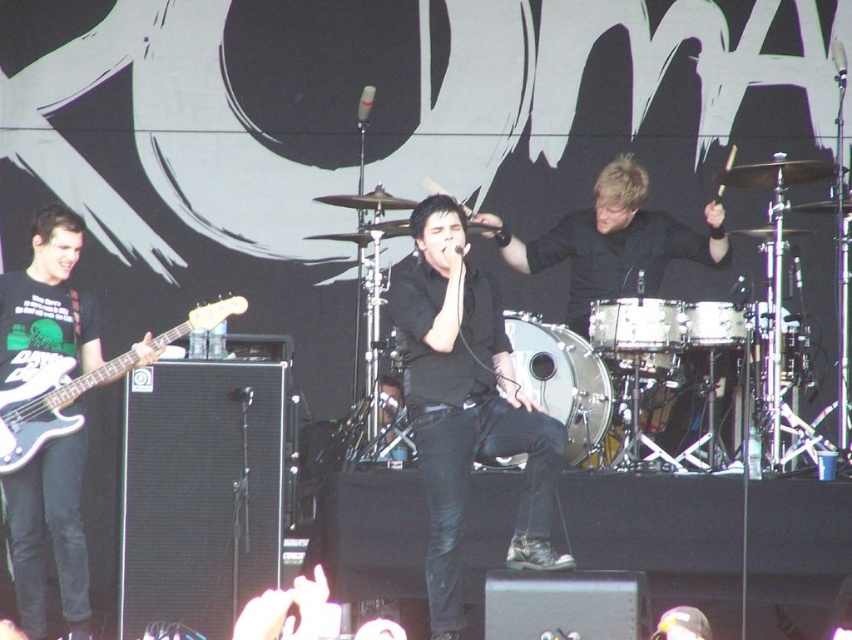
You are a stagehand who needs to adjust the microphone stand between the black matte shirt at center and the matte black guitar at left. The stand requires 3 feet of space to fit. Can you place it there?

The black matte shirt at center is 4.31 feet from the matte black guitar at left, so yes, the microphone stand requiring 3 feet of space can be placed between them since there is enough space.

You are a stagehand setting up the band equipment. You need to retrieve the matte black guitar at left and the white matte electric guitar at left. Based on their positions, which guitar is closer to the floor?

The matte black guitar at left is positioned under the white matte electric guitar at left, so the matte black guitar at left is closer to the floor.

You are a photographer at the concert. You want to capture a photo where the black matte shirt at center and the white matte electric guitar at left are both visible. Based on their positions, which object should be placed on the right side of the photo frame?

The black matte shirt at center should be placed on the right side of the photo frame since it is to the right of the white matte electric guitar at left.